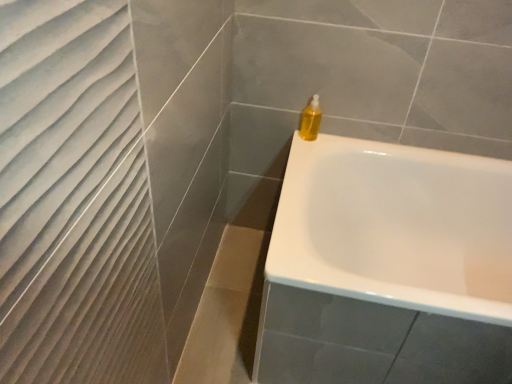
Describe the element at coordinates (310, 120) in the screenshot. The height and width of the screenshot is (384, 512). I see `translucent yellow liquid at upper right` at that location.

What is the approximate width of translucent yellow liquid at upper right?

translucent yellow liquid at upper right is 2.51 inches in width.

Where is `translucent yellow liquid at upper right`? Image resolution: width=512 pixels, height=384 pixels. translucent yellow liquid at upper right is located at coordinates (310, 120).

Find the location of `white glossy bathtub at upper right`. white glossy bathtub at upper right is located at coordinates (396, 227).

What do you see at coordinates (396, 227) in the screenshot? Image resolution: width=512 pixels, height=384 pixels. I see `white glossy bathtub at upper right` at bounding box center [396, 227].

Where is `translucent yellow liquid at upper right`? This screenshot has width=512, height=384. translucent yellow liquid at upper right is located at coordinates (310, 120).

Does white glossy bathtub at upper right appear on the right side of translucent yellow liquid at upper right?

Yes.

Which object is closer to the camera, white glossy bathtub at upper right or translucent yellow liquid at upper right?

Positioned in front is white glossy bathtub at upper right.

Does point (321, 209) come closer to viewer compared to point (303, 110)?

Yes.

From the image's perspective, which one is positioned lower, white glossy bathtub at upper right or translucent yellow liquid at upper right?

white glossy bathtub at upper right is shown below in the image.

In the scene shown: From a real-world perspective, who is located higher, white glossy bathtub at upper right or translucent yellow liquid at upper right?

From a 3D spatial view, translucent yellow liquid at upper right is above.

Considering the sizes of objects white glossy bathtub at upper right and translucent yellow liquid at upper right in the image provided, who is wider, white glossy bathtub at upper right or translucent yellow liquid at upper right?

Wider between the two is white glossy bathtub at upper right.

Considering the sizes of white glossy bathtub at upper right and translucent yellow liquid at upper right in the image, is white glossy bathtub at upper right taller or shorter than translucent yellow liquid at upper right?

white glossy bathtub at upper right is taller than translucent yellow liquid at upper right.

Which of these two, white glossy bathtub at upper right or translucent yellow liquid at upper right, is bigger?

white glossy bathtub at upper right is bigger.

Would you say translucent yellow liquid at upper right is part of white glossy bathtub at upper right's contents?

No, white glossy bathtub at upper right does not contain translucent yellow liquid at upper right.

Would you say white glossy bathtub at upper right is a long distance from translucent yellow liquid at upper right?

Actually, white glossy bathtub at upper right and translucent yellow liquid at upper right are a little close together.

Is white glossy bathtub at upper right turned away from translucent yellow liquid at upper right?

That's not correct — white glossy bathtub at upper right is not looking away from translucent yellow liquid at upper right.

How many degrees apart are the facing directions of white glossy bathtub at upper right and translucent yellow liquid at upper right?

89 degrees.

Where is `soap dispenser located above the white glossy bathtub at upper right (from the image's perspective)`? soap dispenser located above the white glossy bathtub at upper right (from the image's perspective) is located at coordinates (310, 120).

Does translucent yellow liquid at upper right appear on the left side of white glossy bathtub at upper right?

Yes, translucent yellow liquid at upper right is to the left of white glossy bathtub at upper right.

Between translucent yellow liquid at upper right and white glossy bathtub at upper right, which one is positioned behind?

translucent yellow liquid at upper right is behind.

Is point (306, 139) more distant than point (482, 280)?

That is False.

From the image's perspective, is translucent yellow liquid at upper right on white glossy bathtub at upper right?

Yes, from the image's perspective, translucent yellow liquid at upper right is over white glossy bathtub at upper right.

Based on the photo, from a real-world perspective, does translucent yellow liquid at upper right stand above white glossy bathtub at upper right?

Indeed, from a real-world perspective, translucent yellow liquid at upper right stands above white glossy bathtub at upper right.

Looking at their sizes, would you say translucent yellow liquid at upper right is wider or thinner than white glossy bathtub at upper right?

In the image, translucent yellow liquid at upper right appears to be more narrow than white glossy bathtub at upper right.

Who is shorter, translucent yellow liquid at upper right or white glossy bathtub at upper right?

translucent yellow liquid at upper right is shorter.

Based on the photo, considering the sizes of objects translucent yellow liquid at upper right and white glossy bathtub at upper right in the image provided, who is bigger, translucent yellow liquid at upper right or white glossy bathtub at upper right?

white glossy bathtub at upper right is bigger.

Is translucent yellow liquid at upper right inside or outside of white glossy bathtub at upper right?

translucent yellow liquid at upper right lies outside white glossy bathtub at upper right.

Is translucent yellow liquid at upper right not near white glossy bathtub at upper right?

No, translucent yellow liquid at upper right is not far from white glossy bathtub at upper right.

Is translucent yellow liquid at upper right oriented towards white glossy bathtub at upper right?

No, translucent yellow liquid at upper right is not aimed at white glossy bathtub at upper right.

Can you tell me how much translucent yellow liquid at upper right and white glossy bathtub at upper right differ in facing direction?

They differ by 89 degrees in their facing directions.

You are a GUI agent. You are given a task and a screenshot of the screen. Output one action in this format:
    pyautogui.click(x=<x>, y=<y>)
    Task: Click on the bathtub that appears below the translucent yellow liquid at upper right (from the image's perspective)
    This screenshot has height=384, width=512.
    Given the screenshot: What is the action you would take?
    pyautogui.click(x=396, y=227)

In order to click on soap dispenser behind the white glossy bathtub at upper right in this screenshot , I will do `click(310, 120)`.

Identify the location of soap dispenser above the white glossy bathtub at upper right (from a real-world perspective). (310, 120).